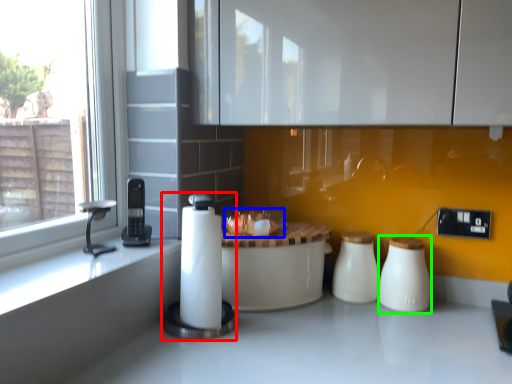
Question: Which object is the farthest from appliance (highlighted by a red box)? Choose among these: food (highlighted by a blue box) or salt shaker (highlighted by a green box).

Choices:
 (A) food
 (B) salt shaker

Answer: (B)